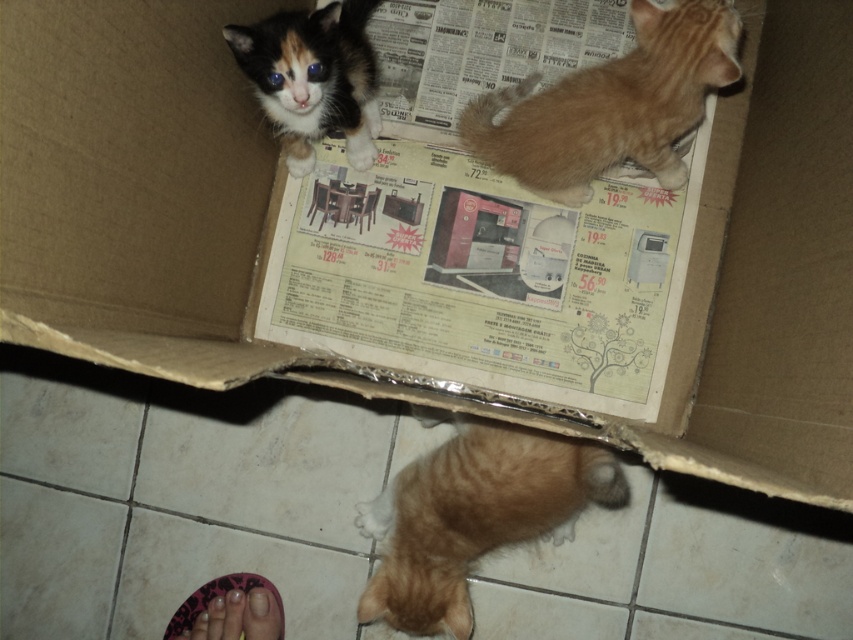
You are a photographer trying to capture a clear shot of the calico fur kitten at upper center and the pink fabric foot at lower left. Which object is positioned closer to your camera lens?

Answer: The calico fur kitten at upper center is closer to the viewer than the pink fabric foot at lower left, so the photographer should focus on the calico fur kitten at upper center first to ensure it is in clear focus.